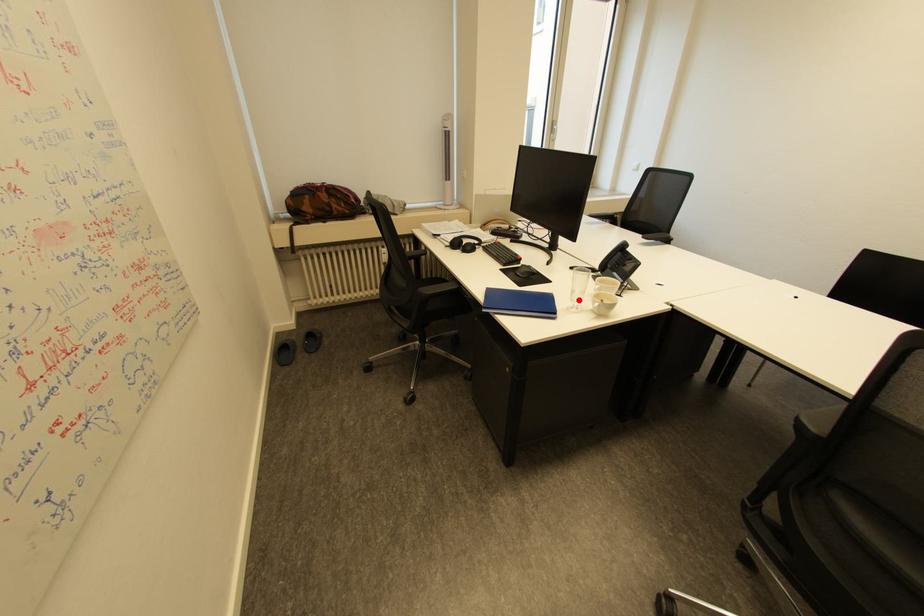
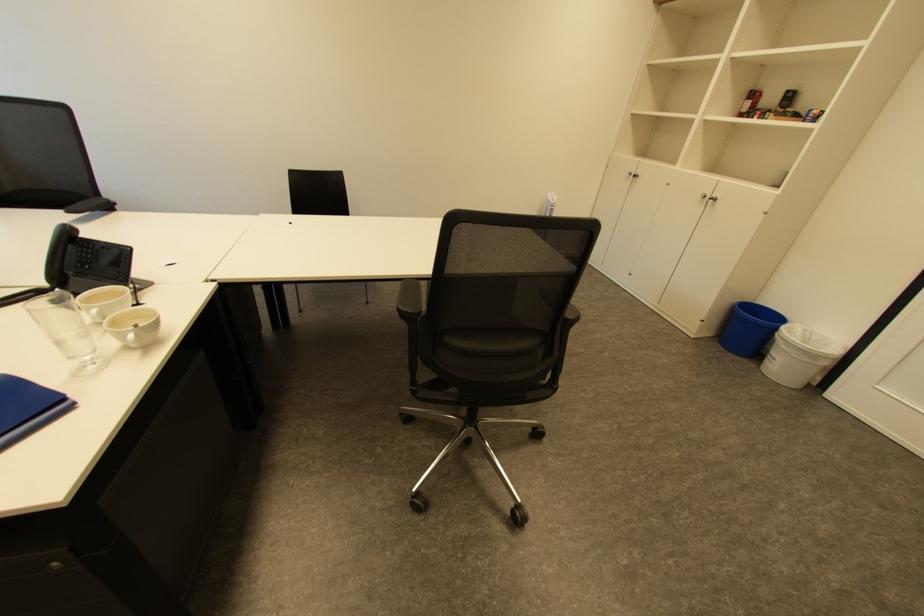
Find the pixel in the second image that matches the highlighted location in the first image.

(76, 358)